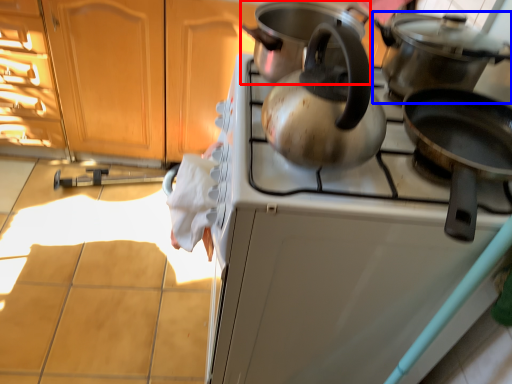
Question: Which object is further to the camera taking this photo, kitchen appliance (highlighted by a red box) or kitchen appliance (highlighted by a blue box)?

Choices:
 (A) kitchen appliance
 (B) kitchen appliance

Answer: (A)